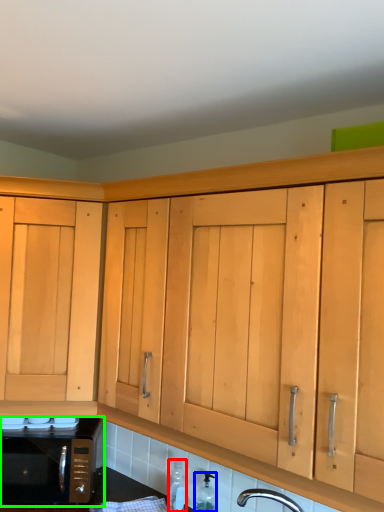
Question: Estimate the real-world distances between objects in this image. Which object is closer to bottle (highlighted by a red box), bottle (highlighted by a blue box) or microwave oven (highlighted by a green box)?

Choices:
 (A) bottle
 (B) microwave oven

Answer: (A)